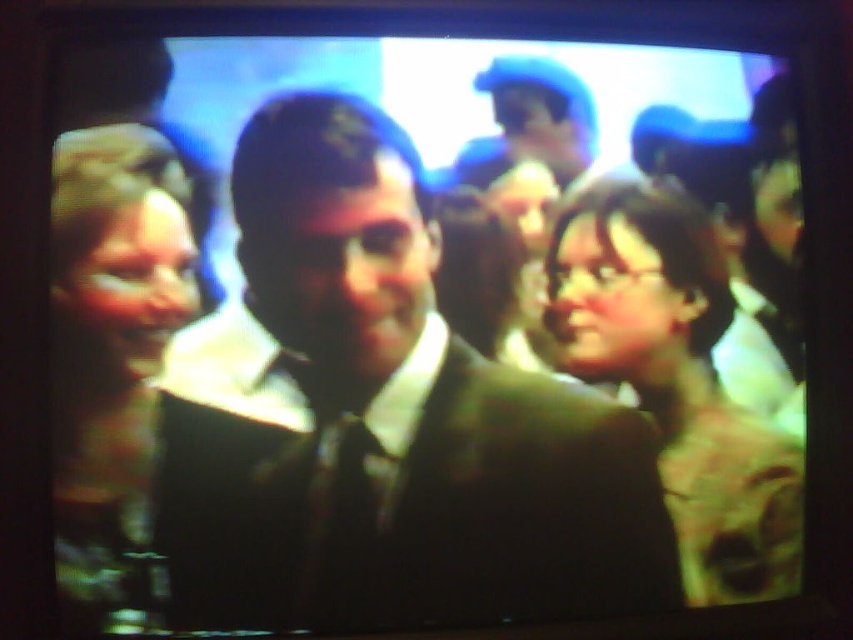
Is point (94, 444) closer to viewer compared to point (683, 449)?

That is True.

Can you confirm if matte black dress at left is positioned below matte black glasses at center?

Actually, matte black dress at left is above matte black glasses at center.

Who is more distant from viewer, [94,548] or [569,356]?

Point [569,356]

At what (x,y) coordinates should I click in order to perform the action: click on matte black dress at left. Please return your answer as a coordinate pair (x, y). Looking at the image, I should click on (115, 365).

Between matte black suit at center and matte black glasses at center, which one appears on the left side from the viewer's perspective?

Positioned to the left is matte black suit at center.

Is point (502, 506) positioned before point (721, 417)?

Yes, it is.

Who is more distant from viewer, (566, 429) or (573, 317)?

Point (566, 429)

Where is `matte black suit at center`? matte black suit at center is located at coordinates (381, 420).

Is point (399, 216) positioned behind point (64, 275)?

Yes.

This screenshot has width=853, height=640. What are the coordinates of `matte black suit at center` in the screenshot? It's located at (381, 420).

Is point (259, 550) farther from viewer compared to point (100, 212)?

Yes, point (259, 550) is behind point (100, 212).

Locate an element on the screen. The image size is (853, 640). matte black suit at center is located at coordinates (381, 420).